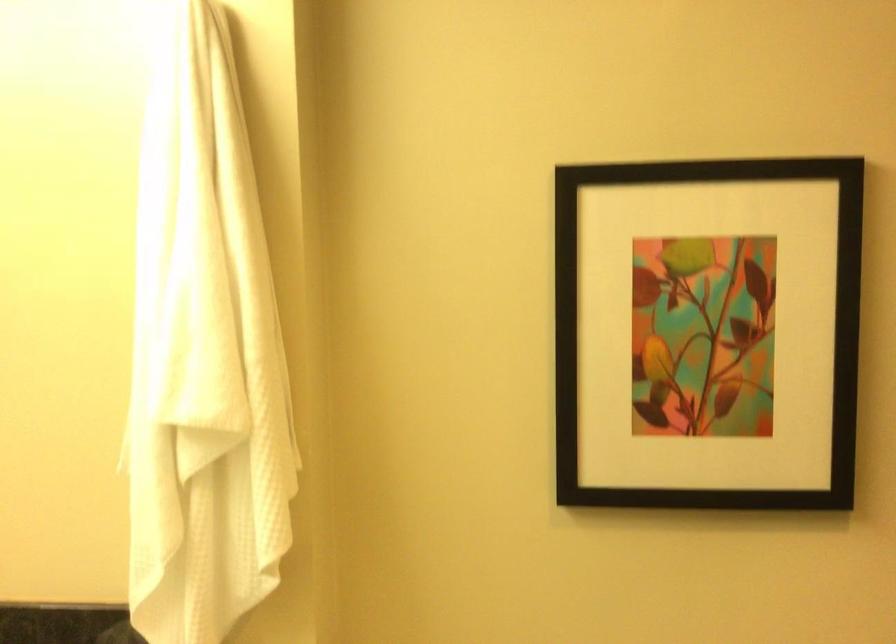
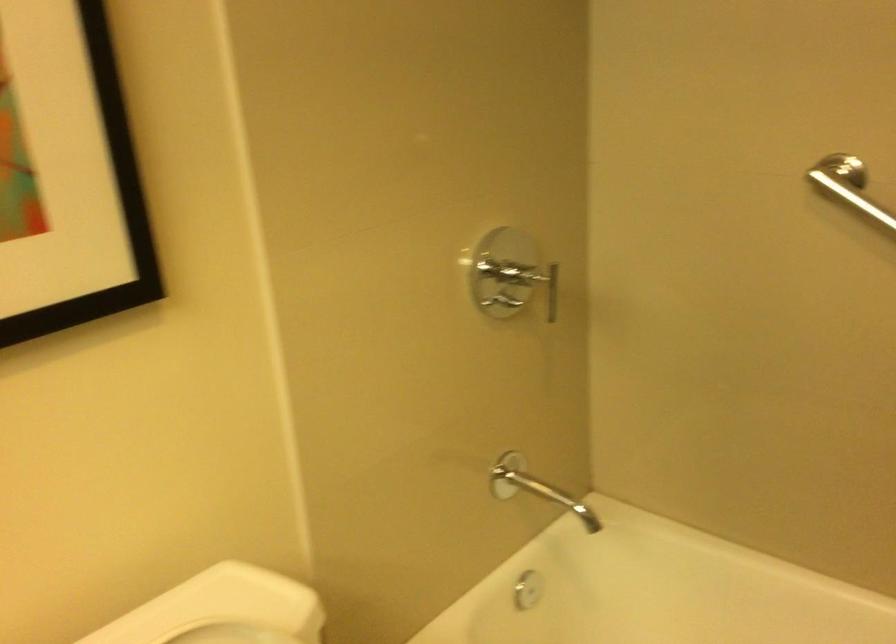
The first image is from the beginning of the video and the second image is from the end. How did the camera likely rotate when shooting the video?

The camera's rotation is toward right-down.